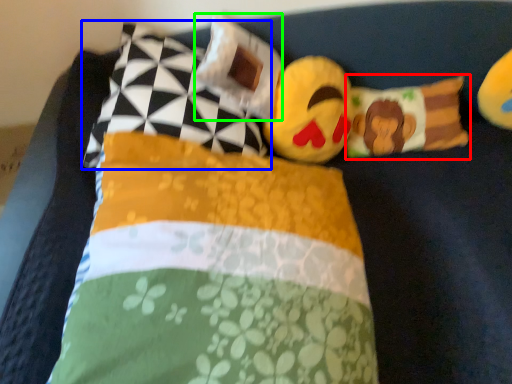
Question: Which object is the farthest from pillow (highlighted by a red box)? Choose among these: pillow (highlighted by a blue box) or pillow (highlighted by a green box).

Choices:
 (A) pillow
 (B) pillow

Answer: (A)